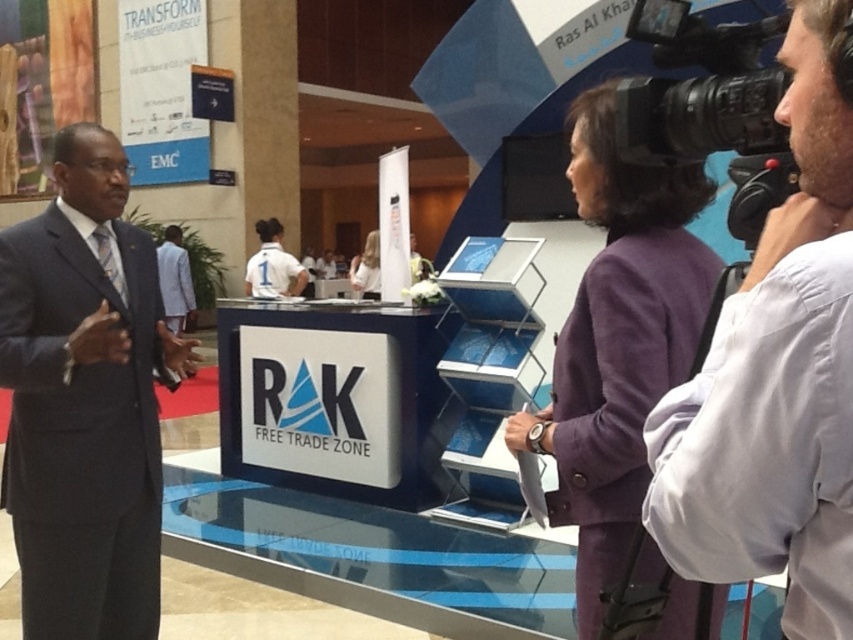
You are attending a business event at the RAK Free Trade Zone. You see a man in a white shirt at center and a man in a dark blue suit at left. Which man is shorter?

The white shirt at center is shorter than the dark blue suit at left.

You are a photographer at the RAK Free Trade Zone event. You need to take a group photo of the white shirt at center and dark blue suit at left. The camera you are using has a minimum focus distance of 5 feet. Can both subjects be in focus at the same time?

The white shirt at center and dark blue suit at left are 5.89 feet apart from each other. Since the minimum focus distance is 5 feet, the 5.89 feet distance between them is sufficient for both subjects to be in focus simultaneously.